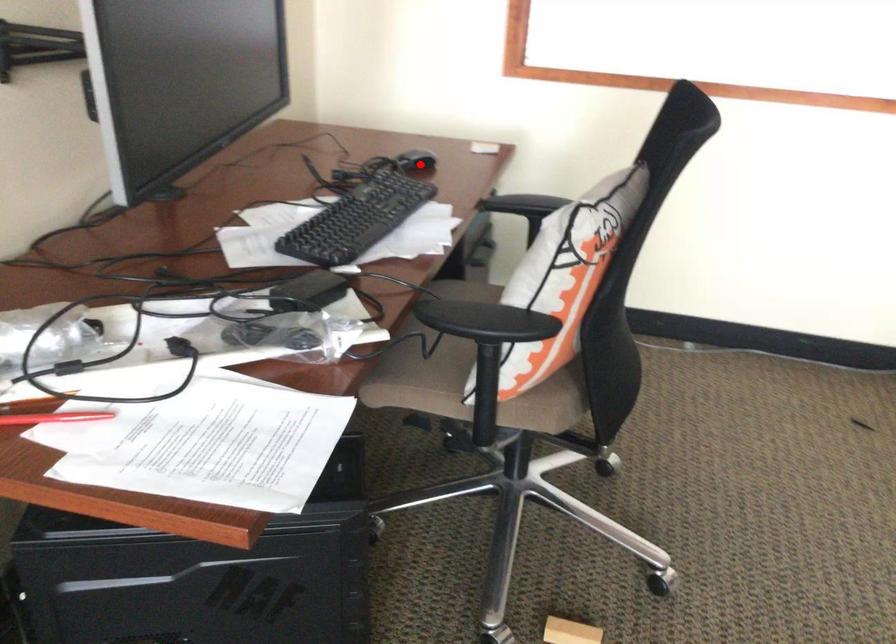
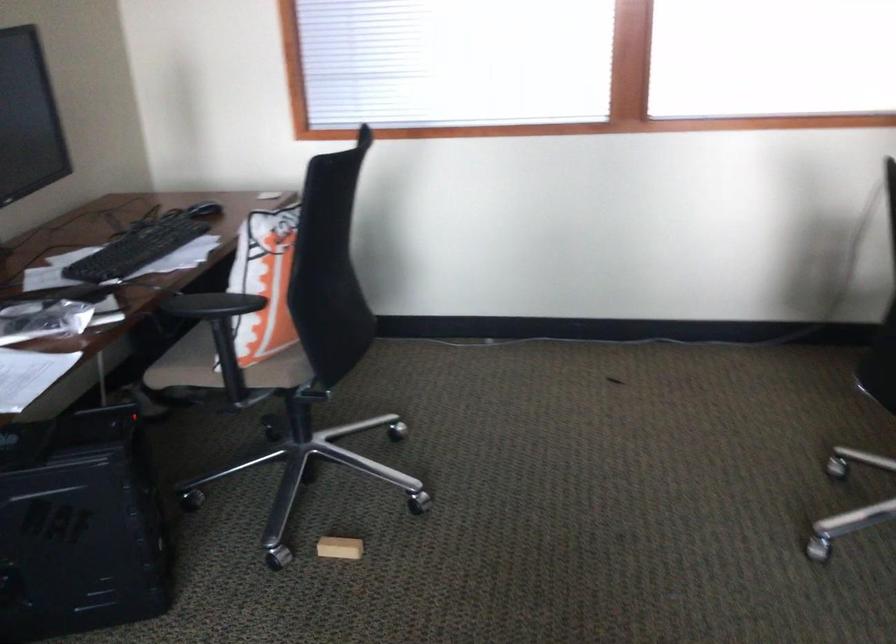
Question: I am providing you with two images of the same scene from different viewpoints. Image1 has a red point marked. In image2, the corresponding 3D location appears at what relative position? Reply with the corresponding letter.

Choices:
 (A) Closer
 (B) Farther

Answer: (B)